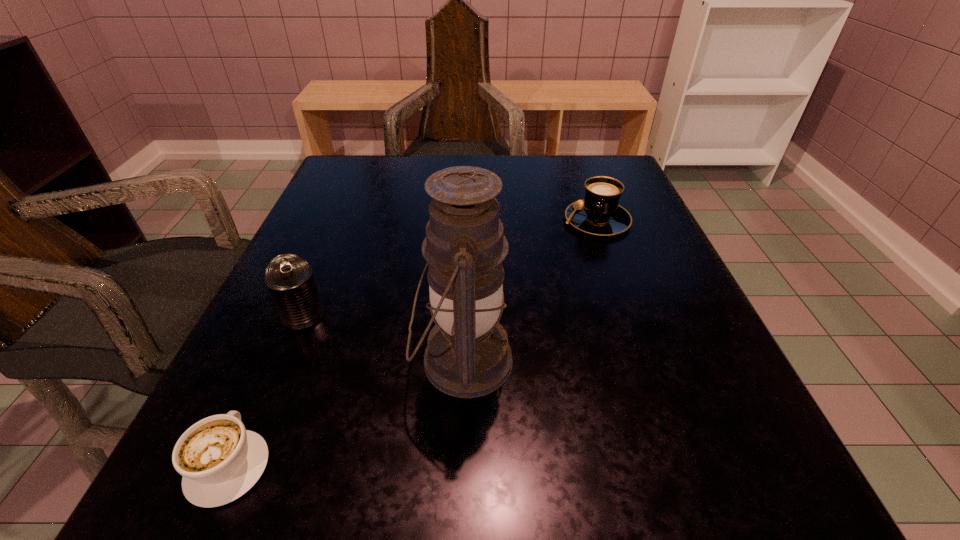
In order to click on vacant area that lies between the shortest object and the second shortest object in this screenshot , I will do `click(413, 343)`.

Identify the location of vacant region between the second object from right to left and the shortest object. (346, 413).

This screenshot has height=540, width=960. In order to click on vacant area between the shortest object and the farthest object in this screenshot , I will do `click(413, 343)`.

Identify the location of free space between the can and the nearest object. (266, 391).

I want to click on unoccupied position between the shorter cappuccino and the farthest object, so click(413, 343).

The width and height of the screenshot is (960, 540). I want to click on object that is the closest one to the second tallest object, so click(467, 355).

Locate which object ranks in proximity to the second tallest object. Please provide its 2D coordinates. Your answer should be formatted as a tuple, i.e. [(x, y)], where the tuple contains the x and y coordinates of a point satisfying the conditions above.

[(467, 355)]

The height and width of the screenshot is (540, 960). I want to click on free space that satisfies the following two spatial constraints: 1. to the right of the shortest object's handle; 2. on the left side of the third shortest object, so click(295, 316).

Find the location of a particular element. vacant region that satisfies the following two spatial constraints: 1. on the back side of the oil lamp; 2. on the left side of the second shortest object is located at coordinates (468, 220).

Identify the location of vacant region that satisfies the following two spatial constraints: 1. to the right of the shortest object's handle; 2. on the right side of the farther cappuccino. (336, 220).